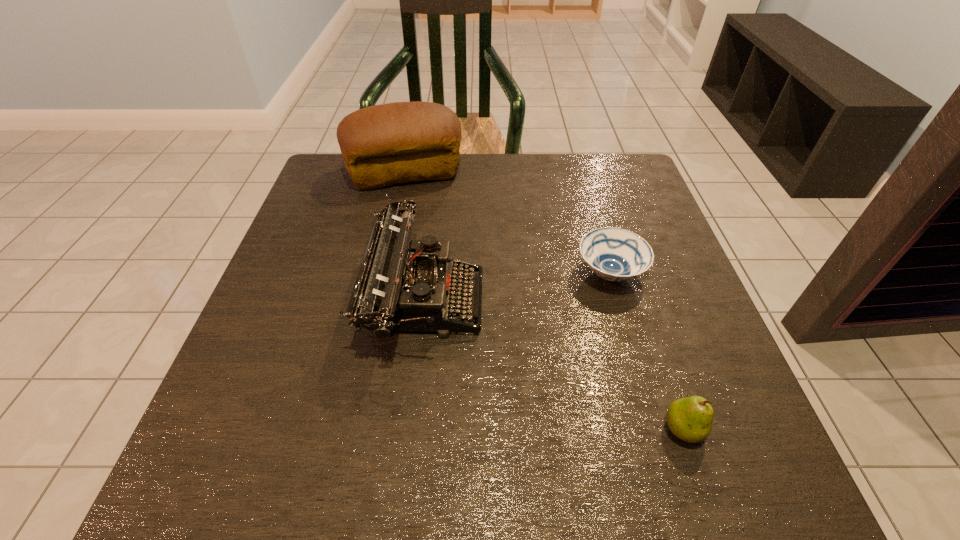
I want to click on vacant area at the far left corner of the desktop, so click(x=323, y=186).

Image resolution: width=960 pixels, height=540 pixels. I want to click on vacant space at the near left corner of the desktop, so click(x=235, y=438).

Identify the location of vacant space at the far right corner of the desktop. (621, 178).

Image resolution: width=960 pixels, height=540 pixels. Find the location of `vacant point at the near right corner`. vacant point at the near right corner is located at coordinates (742, 456).

This screenshot has width=960, height=540. In order to click on free space between the soup bowl and the second tallest object in this screenshot , I will do `click(517, 286)`.

Image resolution: width=960 pixels, height=540 pixels. Find the location of `empty space between the pear and the soup bowl`. empty space between the pear and the soup bowl is located at coordinates (646, 351).

I want to click on free space between the shortest object and the pear, so click(x=646, y=351).

Where is `vacant area that lies between the third shortest object and the shortest object`? vacant area that lies between the third shortest object and the shortest object is located at coordinates (517, 286).

Locate an element on the screen. This screenshot has height=540, width=960. empty space between the third tallest object and the third shortest object is located at coordinates (554, 364).

At what (x,y) coordinates should I click in order to perform the action: click on blank region between the pear and the second tallest object. Please return your answer as a coordinate pair (x, y). The image size is (960, 540). Looking at the image, I should click on (554, 364).